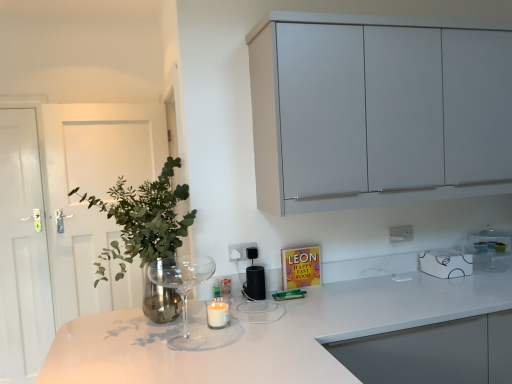
Question: Which direction should I rotate to look at black matte speaker at center, which is the third appliance in right-to-left order, — up or down?

Choices:
 (A) up
 (B) down

Answer: (B)

Question: Is white glossy microwave at upper right, which ranks as the first appliance in right-to-left order, to the right of white glossy door at left from the viewer's perspective?

Choices:
 (A) yes
 (B) no

Answer: (A)

Question: Is white glossy microwave at upper right, which ranks as the first appliance in right-to-left order, bigger than white glossy door at left?

Choices:
 (A) no
 (B) yes

Answer: (A)

Question: Is white glossy microwave at upper right, acting as the third appliance starting from the left, not within white glossy door at left?

Choices:
 (A) yes
 (B) no

Answer: (A)

Question: Could you tell me if white glossy microwave at upper right, which ranks as the first appliance in right-to-left order, is facing white glossy door at left?

Choices:
 (A) no
 (B) yes

Answer: (A)

Question: Considering the relative sizes of white glossy microwave at upper right, which ranks as the first appliance in right-to-left order, and white glossy door at left in the image provided, is white glossy microwave at upper right, which ranks as the first appliance in right-to-left order, smaller than white glossy door at left?

Choices:
 (A) no
 (B) yes

Answer: (B)

Question: From the image's perspective, does white glossy microwave at upper right, acting as the third appliance starting from the left, appear lower than white glossy door at left?

Choices:
 (A) yes
 (B) no

Answer: (B)

Question: Is white glossy countertop at center to the left of transparent glass wine glass at lower left from the viewer's perspective?

Choices:
 (A) yes
 (B) no

Answer: (B)

Question: Can you confirm if white glossy countertop at center is thinner than transparent glass wine glass at lower left?

Choices:
 (A) yes
 (B) no

Answer: (B)

Question: Is white glossy countertop at center located outside transparent glass wine glass at lower left?

Choices:
 (A) yes
 (B) no

Answer: (A)

Question: Can you see white glossy countertop at center touching transparent glass wine glass at lower left?

Choices:
 (A) yes
 (B) no

Answer: (B)

Question: Could you tell me if white glossy countertop at center is turned towards transparent glass wine glass at lower left?

Choices:
 (A) no
 (B) yes

Answer: (A)

Question: From the image's perspective, is white glossy countertop at center under transparent glass wine glass at lower left?

Choices:
 (A) yes
 (B) no

Answer: (A)

Question: From a real-world perspective, is white glossy countertop at center located higher than white wooden door at left?

Choices:
 (A) yes
 (B) no

Answer: (B)